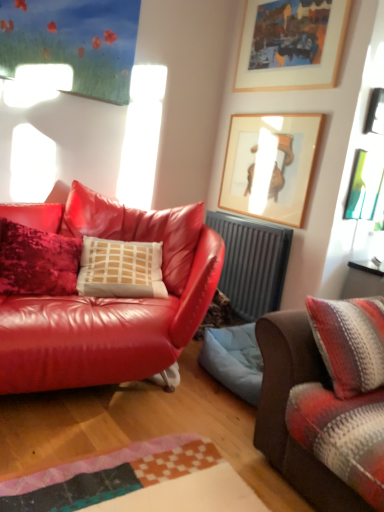
You are a GUI agent. You are given a task and a screenshot of the screen. Output one action in this format:
    pyautogui.click(x=<x>, y=<y>)
    Task: Click on the vacant space situated above gray metallic radiator at center (from a real-world perspective)
    The height and width of the screenshot is (512, 384).
    Given the screenshot: What is the action you would take?
    pyautogui.click(x=262, y=214)